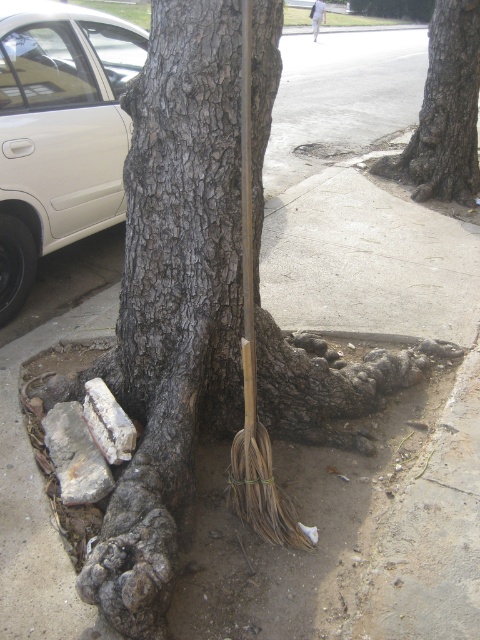
Question: Is rough bark tree at upper right thinner than white fabric at upper center?

Choices:
 (A) no
 (B) yes

Answer: (A)

Question: Which object is farther from the camera taking this photo?

Choices:
 (A) white matte car at left
 (B) rough bark tree at upper right

Answer: (B)

Question: Does white matte car at left appear under white fabric at upper center?

Choices:
 (A) no
 (B) yes

Answer: (B)

Question: Which object appears farthest from the camera in this image?

Choices:
 (A) rough bark tree at upper right
 (B) white fabric at upper center

Answer: (B)

Question: Does white matte car at left appear over white fabric at upper center?

Choices:
 (A) yes
 (B) no

Answer: (B)

Question: Which object is positioned closest to the white fabric at upper center?

Choices:
 (A) white matte car at left
 (B) rough bark tree at upper right

Answer: (B)